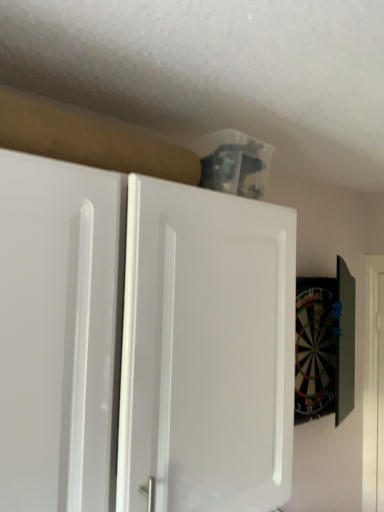
Question: Would you say white smooth door at right is to the left or to the right of white matte cabinet at upper center in the picture?

Choices:
 (A) left
 (B) right

Answer: (B)

Question: Considering the positions of point (364, 429) and point (221, 335), is point (364, 429) closer or farther from the camera than point (221, 335)?

Choices:
 (A) closer
 (B) farther

Answer: (B)

Question: From the image's perspective, is white smooth door at right positioned above or below white matte cabinet at upper center?

Choices:
 (A) below
 (B) above

Answer: (A)

Question: From a real-world perspective, is white matte cabinet at upper center physically located above or below white smooth door at right?

Choices:
 (A) above
 (B) below

Answer: (A)

Question: Do you think white matte cabinet at upper center is within white smooth door at right, or outside of it?

Choices:
 (A) outside
 (B) inside

Answer: (A)

Question: Is white matte cabinet at upper center wider or thinner than white smooth door at right?

Choices:
 (A) wide
 (B) thin

Answer: (A)

Question: In terms of height, does white matte cabinet at upper center look taller or shorter compared to white smooth door at right?

Choices:
 (A) short
 (B) tall

Answer: (A)